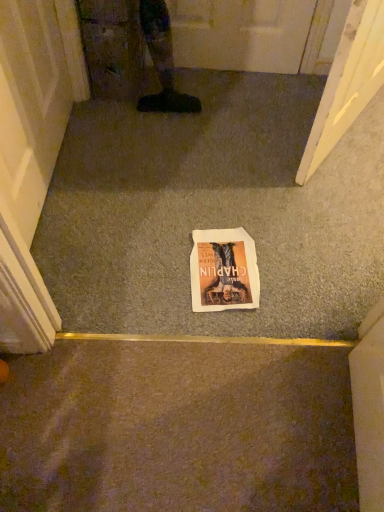
Question: Considering the relative sizes of white paper comic book at center and white paper at center in the image provided, is white paper comic book at center wider than white paper at center?

Choices:
 (A) yes
 (B) no

Answer: (B)

Question: Is the position of white paper comic book at center more distant than that of white paper at center?

Choices:
 (A) no
 (B) yes

Answer: (B)

Question: Is white paper comic book at center surrounding white paper at center?

Choices:
 (A) yes
 (B) no

Answer: (B)

Question: Does white paper comic book at center have a larger size compared to white paper at center?

Choices:
 (A) no
 (B) yes

Answer: (A)

Question: From a real-world perspective, is white paper comic book at center physically below white paper at center?

Choices:
 (A) no
 (B) yes

Answer: (A)

Question: Is white paper comic book at center not within white paper at center?

Choices:
 (A) yes
 (B) no

Answer: (B)

Question: Are white paper at center and white paper comic book at center far apart?

Choices:
 (A) no
 (B) yes

Answer: (A)

Question: Is white paper at center bigger than white paper comic book at center?

Choices:
 (A) no
 (B) yes

Answer: (B)

Question: From a real-world perspective, does white paper at center stand above white paper comic book at center?

Choices:
 (A) no
 (B) yes

Answer: (A)

Question: Is white paper at center wider than white paper comic book at center?

Choices:
 (A) no
 (B) yes

Answer: (B)

Question: Considering the relative positions of white paper at center and white paper comic book at center in the image provided, is white paper at center to the left of white paper comic book at center from the viewer's perspective?

Choices:
 (A) yes
 (B) no

Answer: (B)

Question: Can you confirm if white paper at center is shorter than white paper comic book at center?

Choices:
 (A) no
 (B) yes

Answer: (A)

Question: Considering the positions of white paper at center and white paper comic book at center in the image, is white paper at center bigger or smaller than white paper comic book at center?

Choices:
 (A) small
 (B) big

Answer: (B)